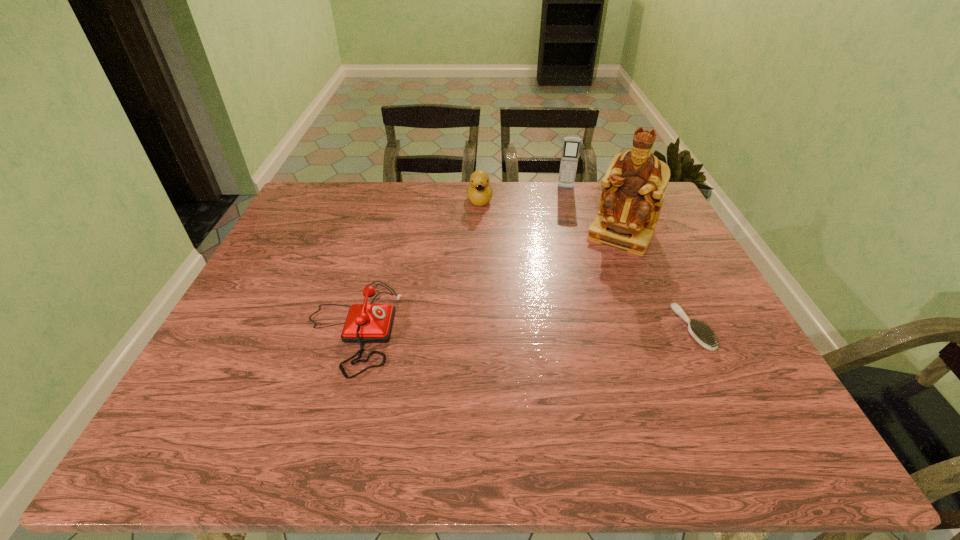
This screenshot has width=960, height=540. In order to click on duckling that is at the far edge in this screenshot , I will do `click(479, 193)`.

Where is `cellular telephone located at the far edge`? This screenshot has width=960, height=540. cellular telephone located at the far edge is located at coordinates [571, 146].

Where is `object that is at the near edge`? object that is at the near edge is located at coordinates (366, 323).

The width and height of the screenshot is (960, 540). What are the coordinates of `scrubbing brush that is at the right edge` in the screenshot? It's located at (703, 335).

This screenshot has width=960, height=540. I want to click on figurine that is at the right edge, so click(633, 188).

Identify the location of object that is at the far right corner. The height and width of the screenshot is (540, 960). (633, 188).

You are a GUI agent. You are given a task and a screenshot of the screen. Output one action in this format:
    pyautogui.click(x=<x>, y=<y>)
    Task: Click on the vacant position at the far edge of the desktop
    Image resolution: width=960 pixels, height=540 pixels.
    Given the screenshot: What is the action you would take?
    pyautogui.click(x=440, y=208)

Where is `free space at the near edge`? The image size is (960, 540). free space at the near edge is located at coordinates (409, 376).

Where is `free space at the left edge of the desktop`? This screenshot has width=960, height=540. free space at the left edge of the desktop is located at coordinates (288, 233).

Where is `vacant space at the right edge`? This screenshot has height=540, width=960. vacant space at the right edge is located at coordinates (660, 286).